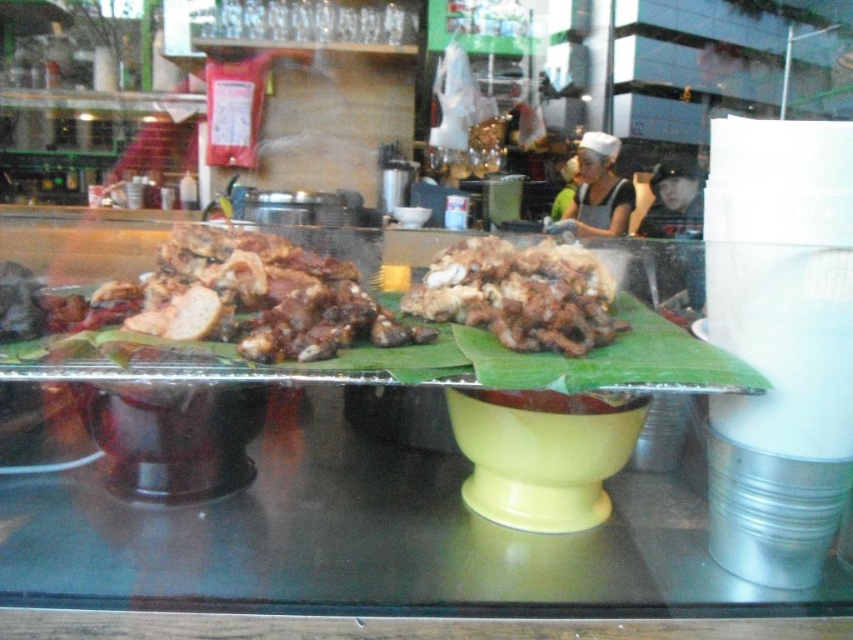
You are a customer at the food stall and want to choose between the brown matte meat at center and the brown crispy meat at center. Which one is larger in size?

The brown matte meat at center is bigger than the brown crispy meat at center, so the brown matte meat at center is the larger option.

You are a customer at the food stall and want to choose between the two plates of meat. The brown matte meat at center and the brown crispy meat at center. Which one has a larger portion size?

The brown matte meat at center has a larger portion size since its width surpasses that of the brown crispy meat at center.

Where is the brown matte meat at center located in the image?

The brown matte meat at center is located at point (256, 298).